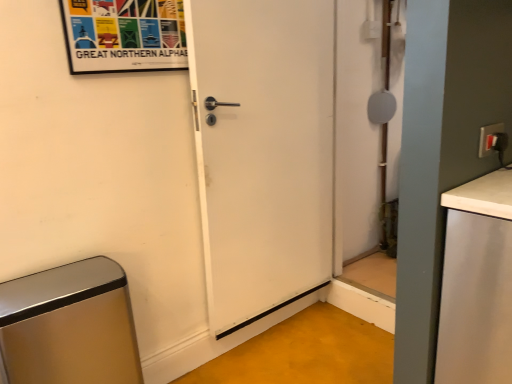
In order to face metallic brushed trash can at lower left, should I rotate leftwards or rightwards?

A 23.258 degree turn to the left will do.

Identify the location of metallic brushed trash can at lower left. (69, 326).

In order to face matte paper poster at upper left, should I rotate leftwards or rightwards?

You should look left and rotate roughly 16.040 degrees.

Identify the location of matte white switch at upper right. (487, 138).

Would you say matte white screen door at right is a long distance from matte paper poster at upper left?

matte white screen door at right is positioned a significant distance from matte paper poster at upper left.

Identify the location of screen door below the matte paper poster at upper left (from a real-world perspective). The image size is (512, 384). (367, 144).

Which of these two, matte white screen door at right or matte paper poster at upper left, stands shorter?

matte paper poster at upper left is shorter.

From the image's perspective, who appears lower, matte paper poster at upper left or white matte countertop at right?

white matte countertop at right is shown below in the image.

The height and width of the screenshot is (384, 512). Identify the location of poster on the left of white matte countertop at right. (124, 35).

Is matte paper poster at upper left positioned with its back to white matte countertop at right?

No, matte paper poster at upper left's orientation is not away from white matte countertop at right.

From their relative heights in the image, would you say matte paper poster at upper left is taller or shorter than white matte countertop at right?

Clearly, matte paper poster at upper left is shorter compared to white matte countertop at right.

Are white matte door at center and matte white switch at upper right far apart?

That's not correct — white matte door at center is a little close to matte white switch at upper right.

How far apart are white matte door at center and matte white switch at upper right?

A distance of 38.33 inches exists between white matte door at center and matte white switch at upper right.

Image resolution: width=512 pixels, height=384 pixels. In order to click on door below the matte white switch at upper right (from a real-world perspective) in this screenshot , I will do `click(263, 151)`.

From a real-world perspective, is metallic brushed trash can at lower left physically below matte white screen door at right?

Yes.

From the image's perspective, is metallic brushed trash can at lower left located above or below matte white screen door at right?

Clearly, from the image's perspective, metallic brushed trash can at lower left is below matte white screen door at right.

Which is correct: metallic brushed trash can at lower left is inside matte white screen door at right, or outside of it?

metallic brushed trash can at lower left is outside matte white screen door at right.

From the picture: Between metallic brushed trash can at lower left and matte white screen door at right, which one has larger size?

Bigger between the two is metallic brushed trash can at lower left.

From the picture: Visually, is white matte countertop at right positioned to the left or to the right of matte paper poster at upper left?

white matte countertop at right is positioned on matte paper poster at upper left's right side.

Which object is wider, white matte countertop at right or matte paper poster at upper left?

white matte countertop at right.

In the image, there is a matte paper poster at upper left. What are the coordinates of `counter top below it (from the image's perspective)` in the screenshot? It's located at (477, 283).

Consider the image. From the image's perspective, which is above, white matte countertop at right or matte paper poster at upper left?

matte paper poster at upper left, from the image's perspective.

Is white matte countertop at right wider than matte white screen door at right?

Yes.

Looking at this image, are white matte countertop at right and matte white screen door at right far apart?

Yes.

From the picture: In the image, is white matte countertop at right on the left side or the right side of matte white screen door at right?

white matte countertop at right is positioned on matte white screen door at right's right side.

Locate an element on the screen. counter top below the matte white screen door at right (from the image's perspective) is located at coordinates (477, 283).

From the image's perspective, which is below, matte white screen door at right or matte white switch at upper right?

matte white switch at upper right.

Is matte white screen door at right positioned before matte white switch at upper right?

No, the depth of matte white screen door at right is greater than that of matte white switch at upper right.

Is matte white screen door at right not close to matte white switch at upper right?

Yes, matte white screen door at right and matte white switch at upper right are located far from each other.

Which is closer to the camera, (335, 233) or (490, 130)?

Point (335, 233) is positioned farther from the camera compared to point (490, 130).

The height and width of the screenshot is (384, 512). I want to click on poster located above the matte white screen door at right (from the image's perspective), so click(124, 35).

Identify the location of counter top on the right of matte paper poster at upper left. (477, 283).

Which object lies nearer to the anchor point matte white switch at upper right, metallic brushed trash can at lower left or matte paper poster at upper left?

matte paper poster at upper left lies closer to matte white switch at upper right than the other object.

Considering their positions, is matte white screen door at right positioned further to matte white switch at upper right than white matte door at center?

Among the two, matte white screen door at right is located further to matte white switch at upper right.

In the scene shown: Based on their spatial positions, is metallic brushed trash can at lower left or matte white screen door at right closer to matte paper poster at upper left?

Among the two, metallic brushed trash can at lower left is located nearer to matte paper poster at upper left.

From the image, which object appears to be nearer to matte paper poster at upper left, metallic brushed trash can at lower left or matte white switch at upper right?

metallic brushed trash can at lower left lies closer to matte paper poster at upper left than the other object.

From the image, which object appears to be farther from white matte door at center, matte white screen door at right or matte paper poster at upper left?

Based on the image, matte white screen door at right appears to be further to white matte door at center.

From the image, which object appears to be farther from white matte countertop at right, white matte door at center or metallic brushed trash can at lower left?

metallic brushed trash can at lower left lies further to white matte countertop at right than the other object.

Looking at the image, which one is located further to matte white switch at upper right, matte paper poster at upper left or white matte door at center?

matte paper poster at upper left lies further to matte white switch at upper right than the other object.

From the image, which object appears to be farther from white matte countertop at right, matte paper poster at upper left or metallic brushed trash can at lower left?

Based on the image, matte paper poster at upper left appears to be further to white matte countertop at right.

Where is `door located between white matte countertop at right and matte white screen door at right in the depth direction`? door located between white matte countertop at right and matte white screen door at right in the depth direction is located at coordinates (263, 151).

Where is `electric outlet situated between matte paper poster at upper left and white matte countertop at right from left to right`? This screenshot has width=512, height=384. electric outlet situated between matte paper poster at upper left and white matte countertop at right from left to right is located at coordinates (487, 138).

At what (x,y) coordinates should I click in order to perform the action: click on screen door between metallic brushed trash can at lower left and white matte countertop at right from left to right. Please return your answer as a coordinate pair (x, y). This screenshot has width=512, height=384. Looking at the image, I should click on (367, 144).

Find the location of a particular element. screen door located between metallic brushed trash can at lower left and matte white switch at upper right in the left-right direction is located at coordinates (367, 144).